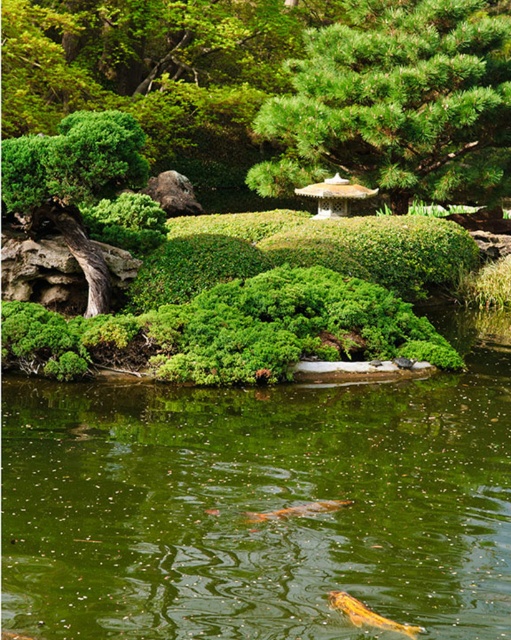
You are a gardener in the Japanese garden and want to place a new decorative stone between the green leafy bush at left and the orange glossy fish at center. Based on their positions, where should you place the stone?

The green leafy bush at left is above the orange glossy fish at center, so you should place the decorative stone below the green leafy bush at left and above the orange glossy fish at center to position it between them.

You are standing at the center of the pond in the Japanese garden. You want to place a small statue exactly at the point where the green leafy bush at left is located. What are the coordinates of that point?

The coordinates of the green leafy bush at left are at point (75, 182).